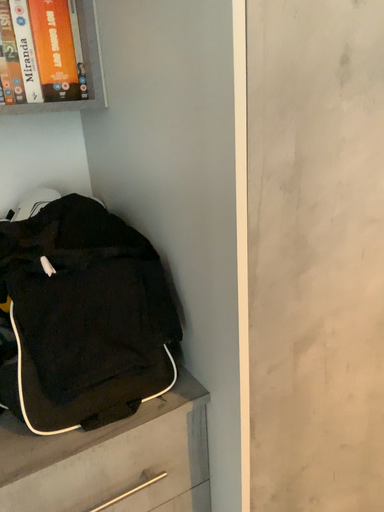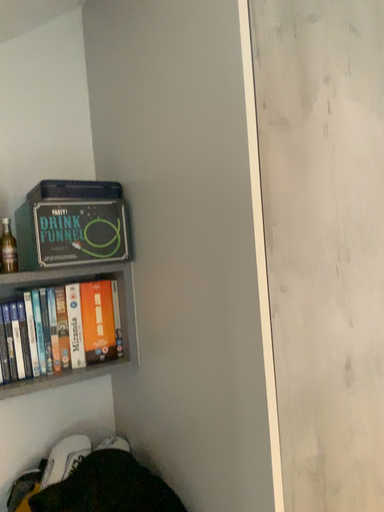
Question: How did the camera likely rotate when shooting the video?

Choices:
 (A) rotated upward
 (B) rotated downward

Answer: (A)